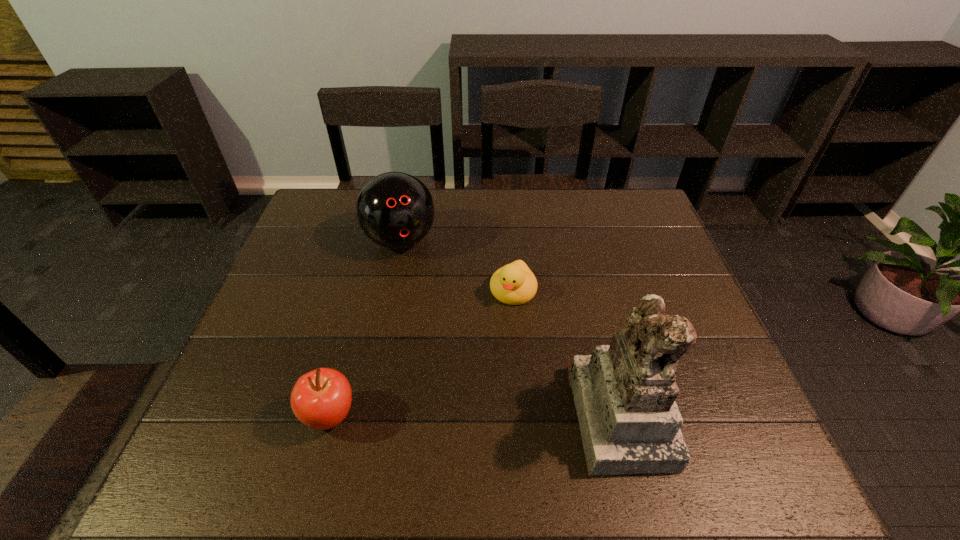
Find the location of a particular element. vacant space on the desktop that is between the apple and the figurine and is positioned on the face of the second object from right to left is located at coordinates (462, 415).

The image size is (960, 540). Identify the location of free space on the desktop that is between the third tallest object and the figurine and is positioned on the surface of the third shortest object near the finger holes. (463, 415).